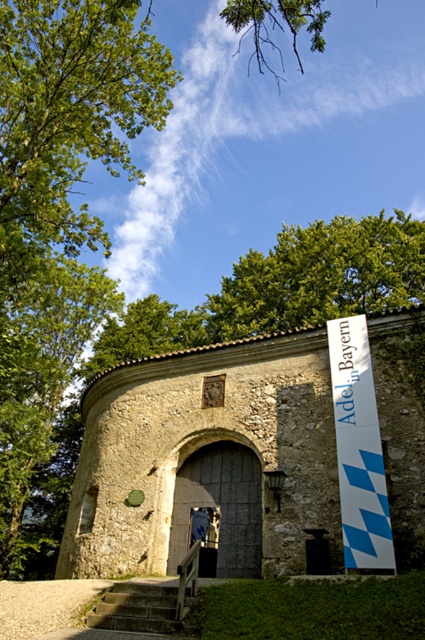
You are standing in front of the historic stone structure and want to locate the point at coordinates (320, 275). According to the scene description, where would this point be located?

The point at coordinates (320, 275) is on the green leafy tree at upper center.

You are standing at the base of the concrete stairs at lower center and want to reach the blue and white checkered banner at right. Which direction should you move to get closer to the banner?

To get closer to the blue and white checkered banner at right, you should move to the right since the banner is positioned to the right of the concrete stairs at lower center.